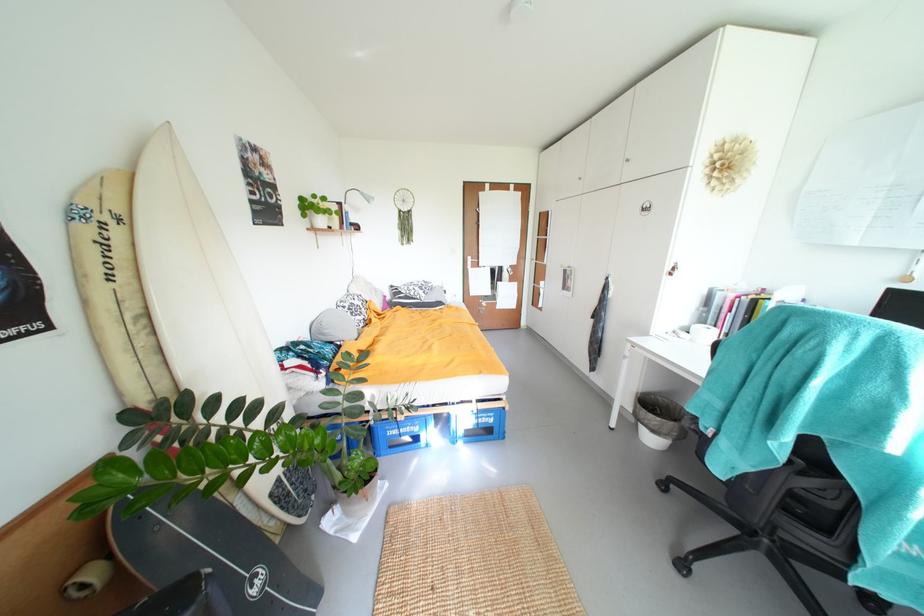
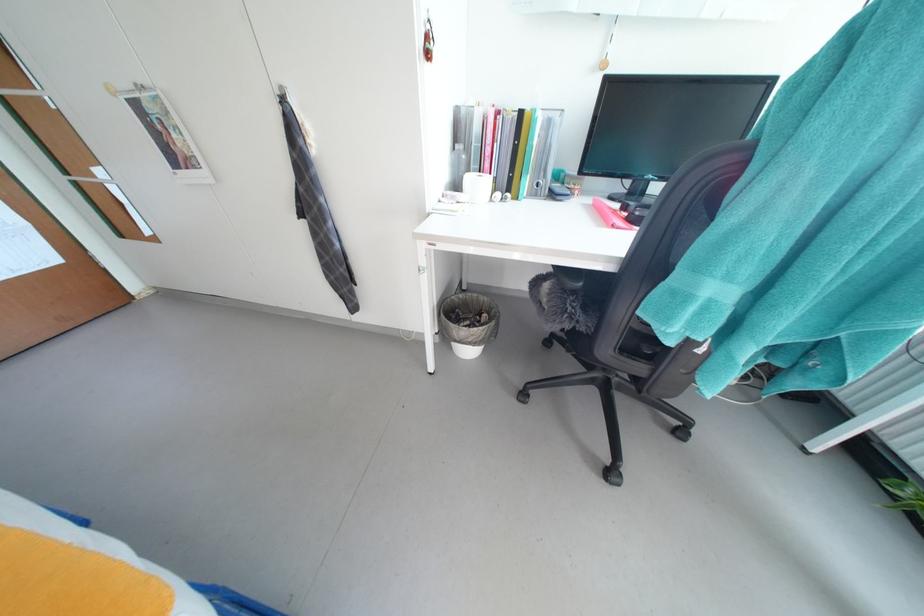
Where in the second image is the point corresponding to (x=712, y=325) from the first image?

(477, 172)